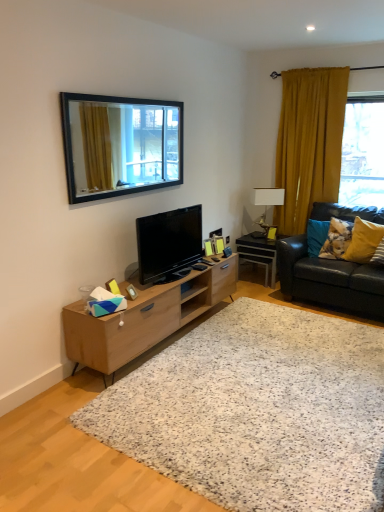
Question: Would you say white speckled rug at center contains wooden picture frame at center?

Choices:
 (A) no
 (B) yes

Answer: (A)

Question: From the image's perspective, is white speckled rug at center on top of wooden picture frame at center?

Choices:
 (A) no
 (B) yes

Answer: (A)

Question: Considering the relative positions of white speckled rug at center and wooden picture frame at center in the image provided, is white speckled rug at center behind wooden picture frame at center?

Choices:
 (A) yes
 (B) no

Answer: (B)

Question: From a real-world perspective, is white speckled rug at center positioned over wooden picture frame at center based on gravity?

Choices:
 (A) no
 (B) yes

Answer: (A)

Question: Is there a large distance between white speckled rug at center and wooden picture frame at center?

Choices:
 (A) no
 (B) yes

Answer: (B)

Question: Does white speckled rug at center have a larger size compared to wooden picture frame at center?

Choices:
 (A) no
 (B) yes

Answer: (B)

Question: From the image's perspective, does matte black tv at center appear lower than black glossy desk at right?

Choices:
 (A) no
 (B) yes

Answer: (A)

Question: From the image's perspective, is matte black tv at center above black glossy desk at right?

Choices:
 (A) no
 (B) yes

Answer: (B)

Question: Can you confirm if matte black tv at center is shorter than black glossy desk at right?

Choices:
 (A) no
 (B) yes

Answer: (A)

Question: Considering the relative sizes of matte black tv at center and black glossy desk at right in the image provided, is matte black tv at center thinner than black glossy desk at right?

Choices:
 (A) no
 (B) yes

Answer: (B)

Question: Would you say matte black tv at center is outside black glossy desk at right?

Choices:
 (A) no
 (B) yes

Answer: (B)

Question: Could you tell me if matte black tv at center is turned towards black glossy desk at right?

Choices:
 (A) no
 (B) yes

Answer: (A)

Question: From a real-world perspective, is light wood/finish tv stand at center physically above fluffy fabric pillow at right, arranged as the first pillow when viewed from the left?

Choices:
 (A) no
 (B) yes

Answer: (A)